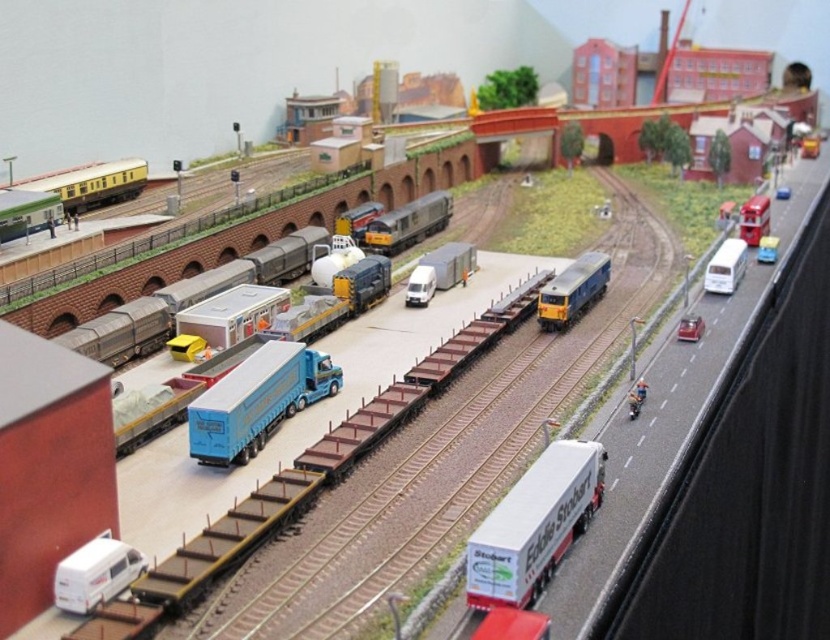
You are a model railway enthusiast examining the scene. You want to place a new miniature car between the metal freight train at center and the metallic blue train at right. Which train should the car be closer to if you want it to appear closer to the front of the scene?

The car should be placed closer to the metal freight train at center because it is already closer to the viewer, so positioning the car near it would maintain the front appearance in the scene.

What is the color and type of the vehicle located at the coordinates point (257, 401) in the model railway scene?

The vehicle at point (257, 401) is a blue metallic truck.